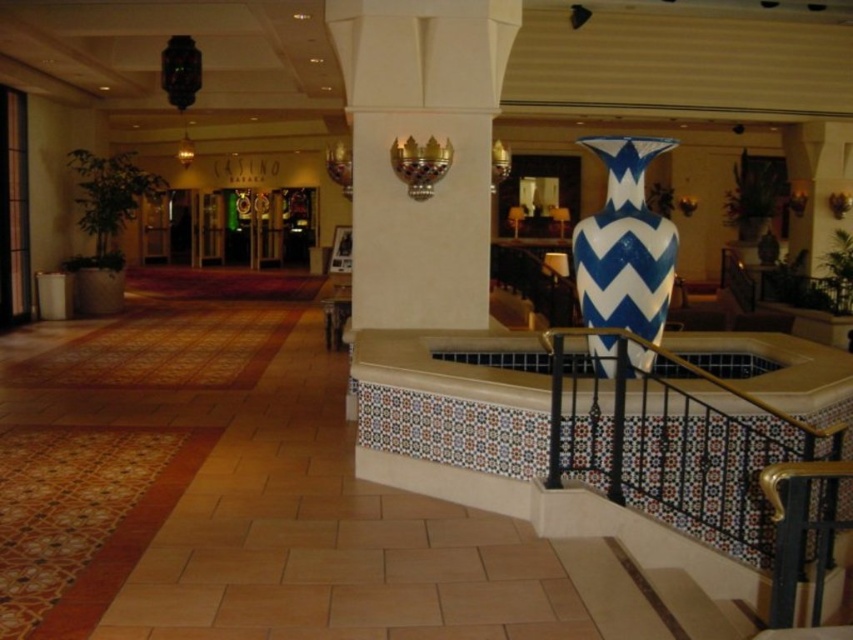
Question: Estimate the real-world distances between objects in this image. Which object is closer to the blue and white ceramic vase at center-right?

Choices:
 (A) white glossy pillar at center
 (B) black metal railing at upper right

Answer: (B)

Question: Which point is closer to the camera?

Choices:
 (A) (634, 461)
 (B) (605, 296)

Answer: (A)

Question: Can you confirm if black metal railing at upper right is bigger than blue and white ceramic vase at center-right?

Choices:
 (A) no
 (B) yes

Answer: (B)

Question: Does white glossy pillar at center appear on the right side of blue and white ceramic vase at center-right?

Choices:
 (A) yes
 (B) no

Answer: (B)

Question: Does white glossy pillar at center have a greater width compared to blue and white ceramic vase at center-right?

Choices:
 (A) yes
 (B) no

Answer: (A)

Question: Which point is closer to the camera taking this photo?

Choices:
 (A) (619, 305)
 (B) (463, 208)

Answer: (A)